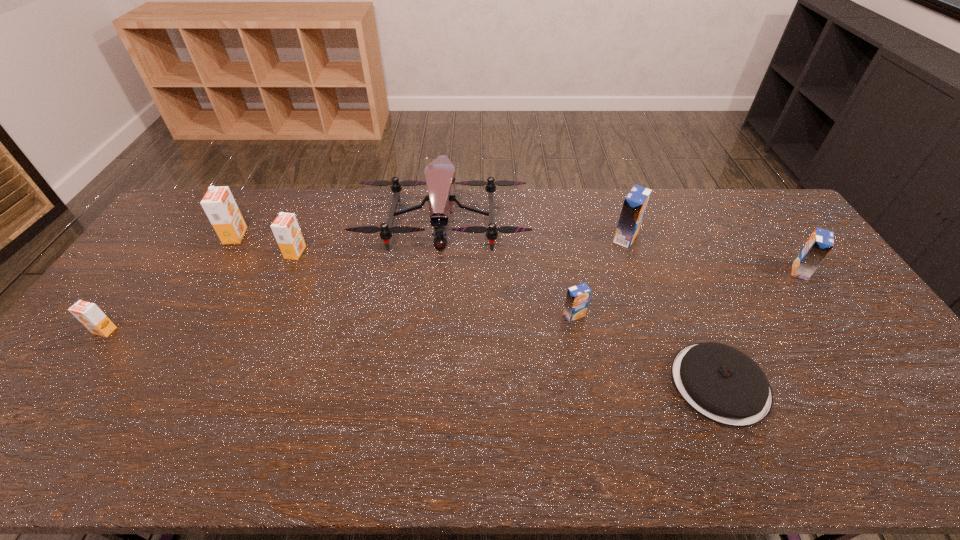
Where is `blank area in the image that satisfies the following two spatial constraints: 1. on the front-facing side of the pancake; 2. on the left side of the drone`? This screenshot has height=540, width=960. blank area in the image that satisfies the following two spatial constraints: 1. on the front-facing side of the pancake; 2. on the left side of the drone is located at coordinates (428, 383).

Where is `vacant region that satisfies the following two spatial constraints: 1. on the back side of the second blue orange_juice from right to left; 2. on the right side of the third orange juice from right to left`? The width and height of the screenshot is (960, 540). vacant region that satisfies the following two spatial constraints: 1. on the back side of the second blue orange_juice from right to left; 2. on the right side of the third orange juice from right to left is located at coordinates (560, 238).